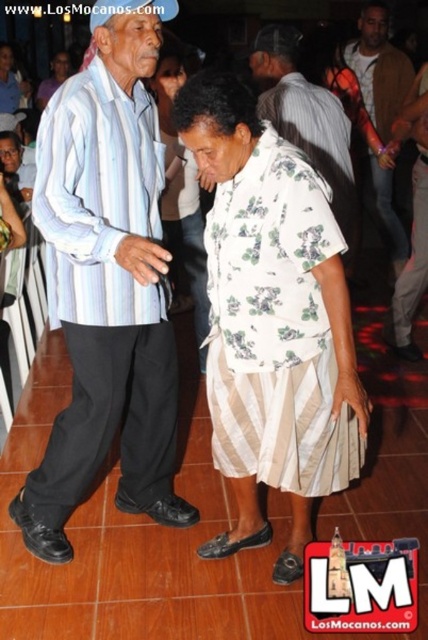
Question: Which point is farther to the camera?

Choices:
 (A) (413, 224)
 (B) (89, 136)

Answer: (A)

Question: Which object is the closest to the floral fabric shirt at center?

Choices:
 (A) floral fabric dress at center
 (B) matte black suit at center
 (C) white floral fabric dress at center
 (D) floral shirt at center

Answer: (B)

Question: Considering the relative positions of white floral fabric dress at center and matte black suit at center in the image provided, where is white floral fabric dress at center located with respect to matte black suit at center?

Choices:
 (A) right
 (B) left

Answer: (B)

Question: Where is floral shirt at center located in relation to matte black suit at center in the image?

Choices:
 (A) left
 (B) right

Answer: (B)

Question: Which point is closer to the camera taking this photo?

Choices:
 (A) coord(255,202)
 (B) coord(68,426)

Answer: (A)

Question: Does floral fabric shirt at center have a larger size compared to matte black suit at center?

Choices:
 (A) no
 (B) yes

Answer: (B)